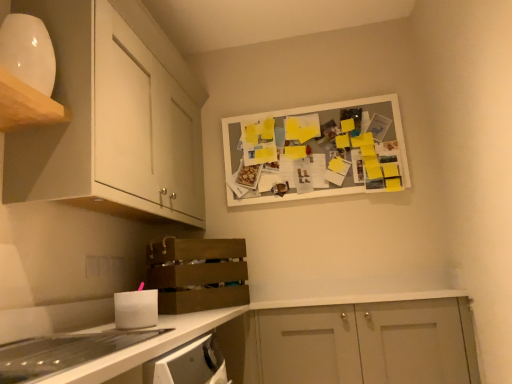
This screenshot has height=384, width=512. Identify the location of free space above white matte bulletin board at upper center (from a real-world perspective). (313, 103).